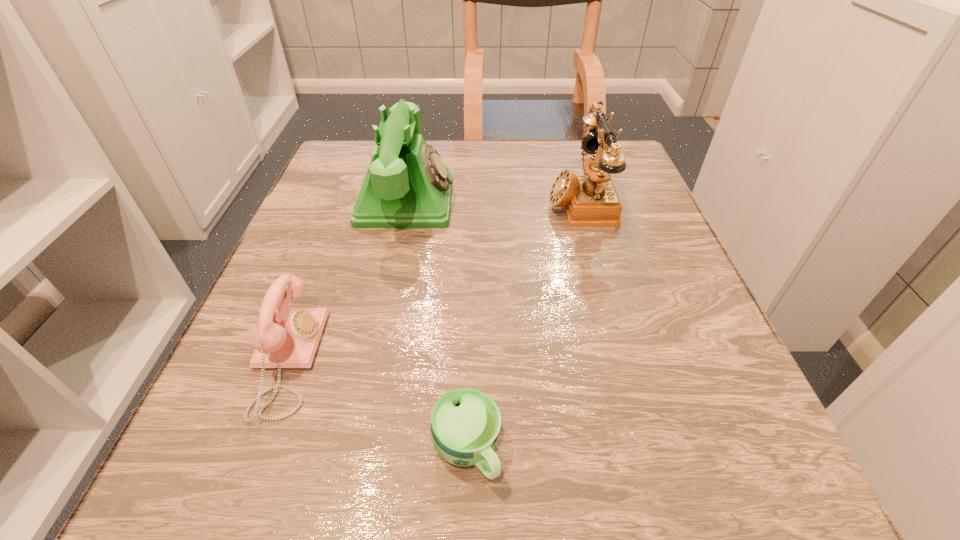
What are the coordinates of `vacant space that satisfies the following two spatial constraints: 1. on the back side of the cup; 2. on the dial of the nearest telephone` in the screenshot? It's located at (468, 360).

You are a GUI agent. You are given a task and a screenshot of the screen. Output one action in this format:
    pyautogui.click(x=<x>, y=<y>)
    Task: Click on the blank space that satisfies the following two spatial constraints: 1. on the dial of the cup; 2. on the right side of the second shortest object
    The height and width of the screenshot is (540, 960).
    Given the screenshot: What is the action you would take?
    pyautogui.click(x=252, y=449)